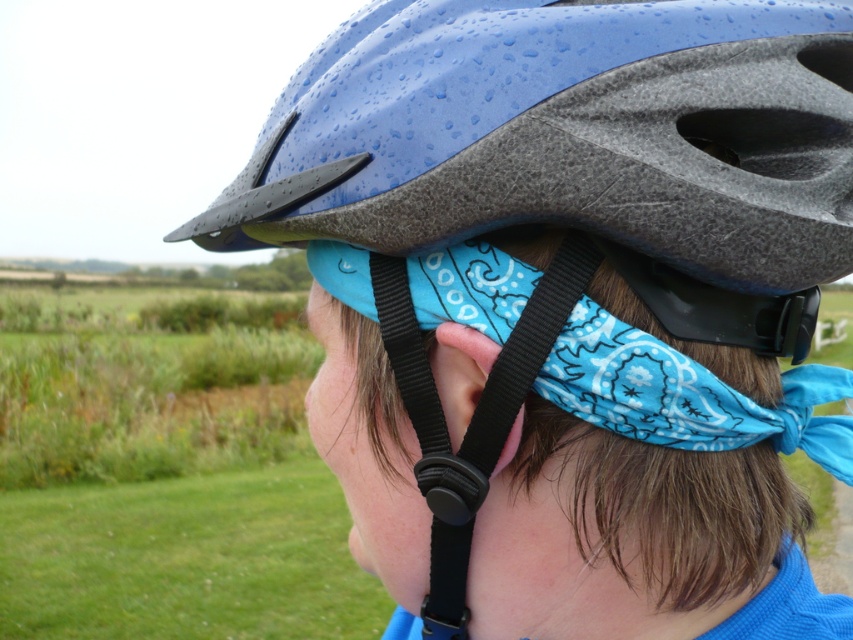
Is blue matte helmet at center shorter than black matte goggles at center?

No, blue matte helmet at center is not shorter than black matte goggles at center.

From the picture: Does blue matte helmet at center appear on the left side of black matte goggles at center?

Indeed, blue matte helmet at center is positioned on the left side of black matte goggles at center.

Who is more distant from viewer, [672,140] or [784,349]?

Positioned behind is point [784,349].

You are a GUI agent. You are given a task and a screenshot of the screen. Output one action in this format:
    pyautogui.click(x=<x>, y=<y>)
    Task: Click on the blue matte helmet at center
    This screenshot has width=853, height=640.
    Given the screenshot: What is the action you would take?
    pyautogui.click(x=566, y=134)

Does blue bandana at center appear under pinksmoothear at center?

Indeed, blue bandana at center is positioned under pinksmoothear at center.

Can you confirm if blue bandana at center is wider than pinksmoothear at center?

Yes.

Where is `blue bandana at center`? Image resolution: width=853 pixels, height=640 pixels. blue bandana at center is located at coordinates (686, 394).

Consider the image. Is blue bandana at center smaller than black matte goggles at center?

Incorrect, blue bandana at center is not smaller in size than black matte goggles at center.

Does blue bandana at center have a lesser width compared to black matte goggles at center?

No, blue bandana at center is not thinner than black matte goggles at center.

This screenshot has width=853, height=640. I want to click on blue bandana at center, so click(686, 394).